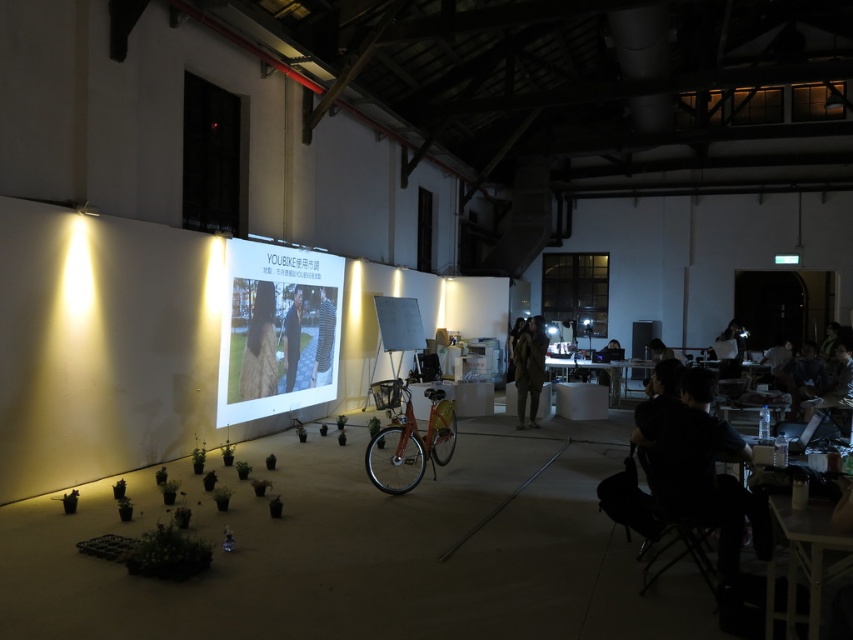
Based on the photo, you are standing in the workshop and need to reach the matte black laptop at lower right without moving the dark blue shirt at center. Is this possible?

The dark blue shirt at center is closer to the viewer than the matte black laptop at lower right, so you can reach the matte black laptop at lower right by going around the dark blue shirt at center.

You are standing in the workshop and want to place a small potted plant between the dark blue shirt at center and the matte black laptop at lower right. Considering their heights, which object should the plant be placed closer to?

The dark blue shirt at center is taller than the matte black laptop at lower right, so the plant should be placed closer to the matte black laptop at lower right to maintain balance in height.